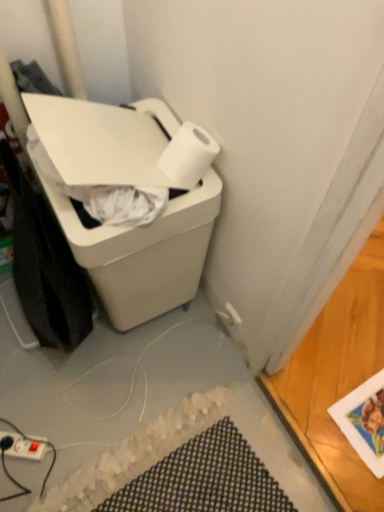
Question: Could you tell me if matte white power plugs and sockets at lower left is facing white plastic trash can at lower left?

Choices:
 (A) yes
 (B) no

Answer: (B)

Question: Is matte white power plugs and sockets at lower left directly adjacent to white plastic trash can at lower left?

Choices:
 (A) yes
 (B) no

Answer: (B)

Question: From a real-world perspective, is matte white power plugs and sockets at lower left under white plastic trash can at lower left?

Choices:
 (A) no
 (B) yes

Answer: (B)

Question: Does matte white power plugs and sockets at lower left lie in front of white plastic trash can at lower left?

Choices:
 (A) no
 (B) yes

Answer: (A)

Question: From a real-world perspective, is matte white power plugs and sockets at lower left physically above white plastic trash can at lower left?

Choices:
 (A) no
 (B) yes

Answer: (A)

Question: In terms of width, does matte white power plugs and sockets at lower left look wider or thinner when compared to white matte paper towel at upper right?

Choices:
 (A) wide
 (B) thin

Answer: (A)

Question: Would you say matte white power plugs and sockets at lower left is to the left or to the right of white matte paper towel at upper right in the picture?

Choices:
 (A) right
 (B) left

Answer: (B)

Question: Is matte white power plugs and sockets at lower left inside the boundaries of white matte paper towel at upper right, or outside?

Choices:
 (A) outside
 (B) inside

Answer: (A)

Question: Looking at the image, does matte white power plugs and sockets at lower left seem bigger or smaller compared to white matte paper towel at upper right?

Choices:
 (A) big
 (B) small

Answer: (B)

Question: Considering the relative positions of white matte paper towel at upper right and matte white power plugs and sockets at lower left in the image provided, is white matte paper towel at upper right to the left or to the right of matte white power plugs and sockets at lower left?

Choices:
 (A) right
 (B) left

Answer: (A)

Question: Considering the positions of white matte paper towel at upper right and matte white power plugs and sockets at lower left in the image, is white matte paper towel at upper right wider or thinner than matte white power plugs and sockets at lower left?

Choices:
 (A) wide
 (B) thin

Answer: (B)

Question: From the image's perspective, is white matte paper towel at upper right located above or below matte white power plugs and sockets at lower left?

Choices:
 (A) above
 (B) below

Answer: (A)

Question: Does point (182, 156) appear closer or farther from the camera than point (8, 446)?

Choices:
 (A) farther
 (B) closer

Answer: (B)

Question: In terms of height, does white plastic trash can at lower left look taller or shorter compared to matte white power plugs and sockets at lower left?

Choices:
 (A) short
 (B) tall

Answer: (B)

Question: Is white plastic trash can at lower left wider or thinner than matte white power plugs and sockets at lower left?

Choices:
 (A) wide
 (B) thin

Answer: (A)